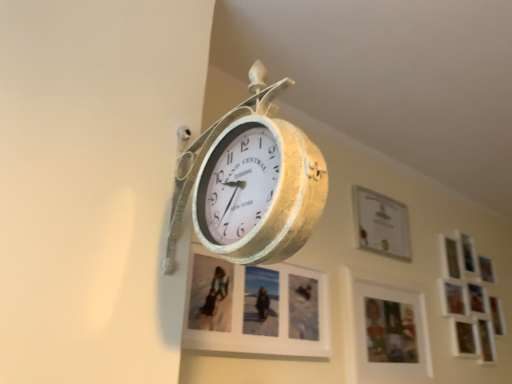
At what (x,y) coordinates should I click in order to perform the action: click on white matte picture frame at upper right, the first picture frame when ordered from right to left. Please return your answer as a coordinate pair (x, y). Looking at the image, I should click on (469, 299).

Between matte white picture frame at upper center, which ranks as the 3th picture frame in left-to-right order, and matte white picture frame at center, the fourth picture frame viewed from the right, which one is positioned behind?

matte white picture frame at upper center, which ranks as the 3th picture frame in left-to-right order, is further from the camera.

Does point (372, 249) appear closer or farther from the camera than point (238, 311)?

Clearly, point (372, 249) is more distant from the camera than point (238, 311).

From their relative heights in the image, would you say matte white picture frame at upper center, the second picture frame viewed from the right, is taller or shorter than matte white picture frame at center, the fourth picture frame viewed from the right?

Clearly, matte white picture frame at upper center, the second picture frame viewed from the right, is shorter compared to matte white picture frame at center, the fourth picture frame viewed from the right.

In the image, is wooden photo frame at lower right, which is the 2th picture frame from left to right, on the left side or the right side of matte white picture frame at upper center, which ranks as the 3th picture frame in left-to-right order?

In the image, wooden photo frame at lower right, which is the 2th picture frame from left to right, appears on the left side of matte white picture frame at upper center, which ranks as the 3th picture frame in left-to-right order.

Looking at this image, between wooden photo frame at lower right, which is the 2th picture frame from left to right, and matte white picture frame at upper center, the second picture frame viewed from the right, which one has smaller size?

Smaller between the two is matte white picture frame at upper center, the second picture frame viewed from the right.

Is wooden photo frame at lower right, which is the 2th picture frame from left to right, turned away from matte white picture frame at upper center, which ranks as the 3th picture frame in left-to-right order?

No, wooden photo frame at lower right, which is the 2th picture frame from left to right, is not facing the opposite direction of matte white picture frame at upper center, which ranks as the 3th picture frame in left-to-right order.

Could you measure the distance between wooden photo frame at lower right, which is the 2th picture frame from left to right, and matte white picture frame at upper center, the second picture frame viewed from the right?

wooden photo frame at lower right, which is the 2th picture frame from left to right, and matte white picture frame at upper center, the second picture frame viewed from the right, are 10.15 inches apart.

From the image's perspective, who appears lower, matte white picture frame at upper center, the second picture frame viewed from the right, or wooden photo frame at lower right, marked as the 3th picture frame in a right-to-left arrangement?

wooden photo frame at lower right, marked as the 3th picture frame in a right-to-left arrangement, is shown below in the image.

Can you confirm if matte white picture frame at upper center, the second picture frame viewed from the right, is thinner than wooden photo frame at lower right, marked as the 3th picture frame in a right-to-left arrangement?

Yes.

Between matte white picture frame at upper center, which ranks as the 3th picture frame in left-to-right order, and wooden photo frame at lower right, which is the 2th picture frame from left to right, which one has less height?

matte white picture frame at upper center, which ranks as the 3th picture frame in left-to-right order, is shorter.

From a real-world perspective, which object stands above the other?

In real-world perspective, matte white picture frame at upper center, which ranks as the 3th picture frame in left-to-right order, is above.

Measure the distance from matte white picture frame at upper center, which ranks as the 3th picture frame in left-to-right order, to gold textured clock at center.

37.54 inches.

In the image, is matte white picture frame at upper center, the second picture frame viewed from the right, positioned in front of or behind gold textured clock at center?

matte white picture frame at upper center, the second picture frame viewed from the right, is behind gold textured clock at center.

Considering the sizes of objects matte white picture frame at upper center, which ranks as the 3th picture frame in left-to-right order, and gold textured clock at center in the image provided, who is taller, matte white picture frame at upper center, which ranks as the 3th picture frame in left-to-right order, or gold textured clock at center?

Standing taller between the two is gold textured clock at center.

Consider the image. Visually, is matte white picture frame at upper center, which ranks as the 3th picture frame in left-to-right order, positioned to the left or to the right of gold textured clock at center?

Clearly, matte white picture frame at upper center, which ranks as the 3th picture frame in left-to-right order, is on the right of gold textured clock at center in the image.

From a real-world perspective, is matte white picture frame at center, the fourth picture frame viewed from the right, positioned above or below matte white picture frame at upper center, the second picture frame viewed from the right?

Clearly, from a real-world perspective, matte white picture frame at center, the fourth picture frame viewed from the right, is below matte white picture frame at upper center, the second picture frame viewed from the right.

Between matte white picture frame at center, the fourth picture frame viewed from the right, and matte white picture frame at upper center, the second picture frame viewed from the right, which one appears on the left side from the viewer's perspective?

Positioned to the left is matte white picture frame at center, the fourth picture frame viewed from the right.

Is point (318, 318) in front of point (379, 234)?

Yes, point (318, 318) is closer to viewer.

Would you say matte white picture frame at center, the 1th picture frame viewed from the left, is a long distance from matte white picture frame at upper center, the second picture frame viewed from the right?

They are positioned close to each other.

Is gold textured clock at center to the right of wooden photo frame at lower right, which is the 2th picture frame from left to right, from the viewer's perspective?

No, gold textured clock at center is not to the right of wooden photo frame at lower right, which is the 2th picture frame from left to right.

Considering the positions of point (279, 237) and point (383, 365), is point (279, 237) closer or farther from the camera than point (383, 365)?

Point (279, 237).

Which of these two, gold textured clock at center or wooden photo frame at lower right, which is the 2th picture frame from left to right, is smaller?

wooden photo frame at lower right, which is the 2th picture frame from left to right.

Consider the image. Is matte white picture frame at center, the 1th picture frame viewed from the left, aimed at white matte picture frame at upper right, the first picture frame when ordered from right to left?

No, matte white picture frame at center, the 1th picture frame viewed from the left, is not oriented towards white matte picture frame at upper right, the first picture frame when ordered from right to left.

Measure the distance from matte white picture frame at center, the 1th picture frame viewed from the left, to white matte picture frame at upper right, the first picture frame when ordered from right to left.

matte white picture frame at center, the 1th picture frame viewed from the left, is 35.74 inches away from white matte picture frame at upper right, the first picture frame when ordered from right to left.

In the image, is matte white picture frame at center, the 1th picture frame viewed from the left, on the left side or the right side of white matte picture frame at upper right, the first picture frame when ordered from right to left?

Based on their positions, matte white picture frame at center, the 1th picture frame viewed from the left, is located to the left of white matte picture frame at upper right, the first picture frame when ordered from right to left.

Can you confirm if matte white picture frame at center, the 1th picture frame viewed from the left, is shorter than white matte picture frame at upper right, arranged as the fourth picture frame when viewed from the left?

Correct, matte white picture frame at center, the 1th picture frame viewed from the left, is not as tall as white matte picture frame at upper right, arranged as the fourth picture frame when viewed from the left.

At what (x,y) coordinates should I click in order to perform the action: click on picture frame located above the matte white picture frame at center, the fourth picture frame viewed from the right (from the image's perspective). Please return your answer as a coordinate pair (x, y). Looking at the image, I should click on coord(381,224).

From a real-world perspective, which picture frame is the 3rd one above the wooden photo frame at lower right, marked as the 3th picture frame in a right-to-left arrangement? Please provide its 2D coordinates.

[(381, 224)]

Based on their spatial positions, is white matte picture frame at upper right, arranged as the fourth picture frame when viewed from the left, or matte white picture frame at upper center, which ranks as the 3th picture frame in left-to-right order, closer to matte white picture frame at center, the 1th picture frame viewed from the left?

Among the two, matte white picture frame at upper center, which ranks as the 3th picture frame in left-to-right order, is located nearer to matte white picture frame at center, the 1th picture frame viewed from the left.

Estimate the real-world distances between objects in this image. Which object is closer to white matte picture frame at upper right, the first picture frame when ordered from right to left, gold textured clock at center or matte white picture frame at upper center, which ranks as the 3th picture frame in left-to-right order?

The object closer to white matte picture frame at upper right, the first picture frame when ordered from right to left, is matte white picture frame at upper center, which ranks as the 3th picture frame in left-to-right order.

Considering their positions, is gold textured clock at center positioned further to matte white picture frame at upper center, which ranks as the 3th picture frame in left-to-right order, than wooden photo frame at lower right, marked as the 3th picture frame in a right-to-left arrangement?

gold textured clock at center.

Looking at the image, which one is located further to wooden photo frame at lower right, marked as the 3th picture frame in a right-to-left arrangement, matte white picture frame at upper center, the second picture frame viewed from the right, or gold textured clock at center?

gold textured clock at center.

When comparing their distances from white matte picture frame at upper right, the first picture frame when ordered from right to left, does matte white picture frame at center, the fourth picture frame viewed from the right, or gold textured clock at center seem further?

The object further to white matte picture frame at upper right, the first picture frame when ordered from right to left, is gold textured clock at center.

When comparing their distances from matte white picture frame at center, the fourth picture frame viewed from the right, does gold textured clock at center or wooden photo frame at lower right, marked as the 3th picture frame in a right-to-left arrangement, seem closer?

wooden photo frame at lower right, marked as the 3th picture frame in a right-to-left arrangement.

Based on their spatial positions, is white matte picture frame at upper right, the first picture frame when ordered from right to left, or matte white picture frame at upper center, the second picture frame viewed from the right, further from wooden photo frame at lower right, which is the 2th picture frame from left to right?

white matte picture frame at upper right, the first picture frame when ordered from right to left, is further to wooden photo frame at lower right, which is the 2th picture frame from left to right.

In the scene shown: Considering their positions, is matte white picture frame at center, the fourth picture frame viewed from the right, positioned closer to wooden photo frame at lower right, which is the 2th picture frame from left to right, than gold textured clock at center?

Among the two, matte white picture frame at center, the fourth picture frame viewed from the right, is located nearer to wooden photo frame at lower right, which is the 2th picture frame from left to right.

You are a GUI agent. You are given a task and a screenshot of the screen. Output one action in this format:
    pyautogui.click(x=<x>, y=<y>)
    Task: Click on the picture frame between wooden photo frame at lower right, which is the 2th picture frame from left to right, and white matte picture frame at upper right, the first picture frame when ordered from right to left
    The width and height of the screenshot is (512, 384).
    Given the screenshot: What is the action you would take?
    pyautogui.click(x=381, y=224)

What are the coordinates of `picture frame between matte white picture frame at center, the 1th picture frame viewed from the left, and matte white picture frame at upper center, which ranks as the 3th picture frame in left-to-right order, along the z-axis` in the screenshot? It's located at (390, 334).

Where is `picture frame between gold textured clock at center and wooden photo frame at lower right, which is the 2th picture frame from left to right, in the front-back direction`? picture frame between gold textured clock at center and wooden photo frame at lower right, which is the 2th picture frame from left to right, in the front-back direction is located at coordinates (256, 308).